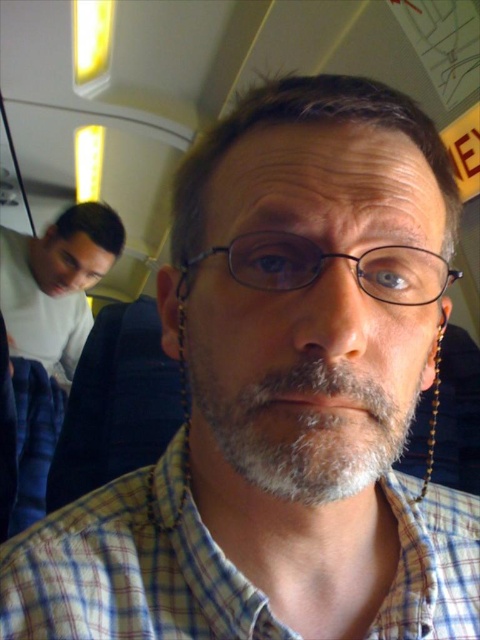
Question: Considering the real-world distances, which object is farthest from the plaid cotton shirt at center?

Choices:
 (A) black plastic glasses at center
 (B) light gray sweater at left
 (C) gray matte beard at center

Answer: (B)

Question: Is gray matte beard at center in front of light gray sweater at left?

Choices:
 (A) yes
 (B) no

Answer: (A)

Question: Which point is closer to the camera?

Choices:
 (A) light gray sweater at left
 (B) plaid cotton shirt at center
 (C) black plastic glasses at center

Answer: (C)

Question: Does plaid cotton shirt at center appear over gray matte beard at center?

Choices:
 (A) yes
 (B) no

Answer: (B)

Question: Which of these objects is positioned farthest from the gray matte beard at center?

Choices:
 (A) light gray sweater at left
 (B) plaid cotton shirt at center
 (C) black plastic glasses at center

Answer: (A)

Question: Is plaid cotton shirt at center further to camera compared to black plastic glasses at center?

Choices:
 (A) yes
 (B) no

Answer: (A)